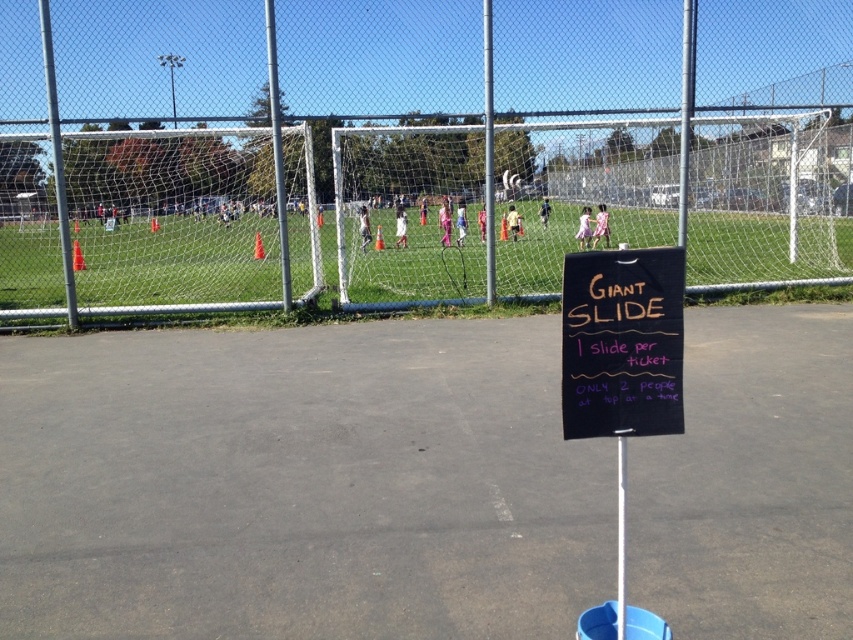
Question: Where is metallic silver pole at center located in relation to white plastic pole at center in the image?

Choices:
 (A) above
 (B) below

Answer: (A)

Question: Can you confirm if green grass at center is thinner than white plastic pole at center?

Choices:
 (A) no
 (B) yes

Answer: (A)

Question: Estimate the real-world distances between objects in this image. Which object is farther from the green grass at center?

Choices:
 (A) white plastic pole at center
 (B) metallic chain-link fence at upper center
 (C) black chalkboard at center
 (D) silver metallic pole at left

Answer: (C)

Question: Based on their relative distances, which object is farther from the white plastic pole at center?

Choices:
 (A) green grass at center
 (B) metallic chain-link fence at upper center

Answer: (B)

Question: Among these points, which one is farthest from the camera?

Choices:
 (A) (193, 301)
 (B) (622, 497)
 (C) (605, 362)

Answer: (A)

Question: Is metallic silver pole at center below white plastic pole at center?

Choices:
 (A) yes
 (B) no

Answer: (B)